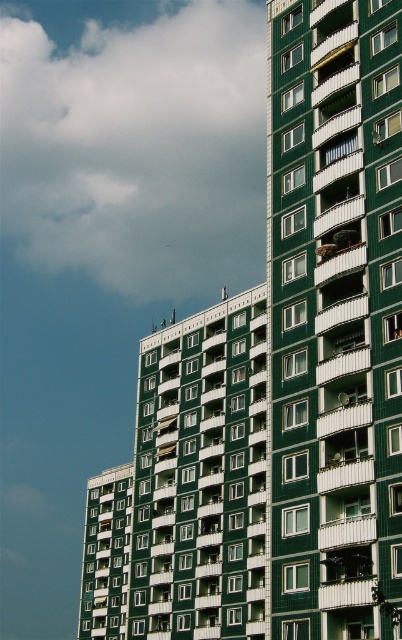
Consider the image. You are standing at the entrance of a park and see the green matte building at center. If you want to take a photo of the building with the park fountain in the foreground, where should you position yourself relative to the building?

To include both the green matte building at center and the park fountain in the foreground in your photo, you should position yourself in front of the building, ensuring the fountain is between you and the building.

You are standing in a park across from the green matte building at center and the cloudy sky at upper left. Which object is positioned higher in the image?

The cloudy sky at upper left is positioned higher in the image than the green matte building at center.

You are standing in front of the green matte building at center and looking towards the cloudy sky at upper left. Which object is nearer to your eyes?

The green matte building at center is closer to the viewer than cloudy sky at upper left, so the green matte building at center is nearer to your eyes.